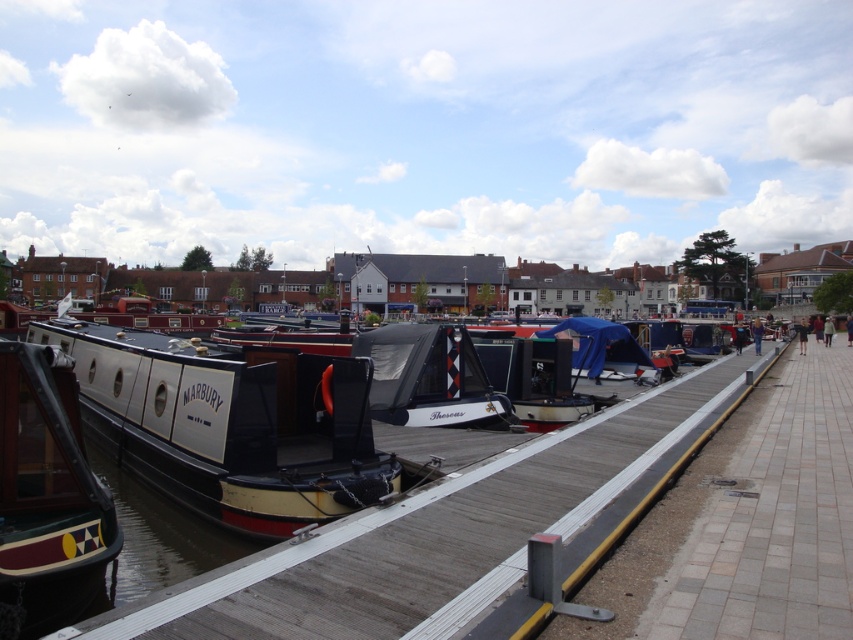
Question: Based on their relative distances, which object is nearer to the black polished wood boat at left?

Choices:
 (A) wooden dock at center
 (B) black canvas boat at center
 (C) maroon glossy boat at left

Answer: (C)

Question: In this image, where is black polished wood boat at left located relative to black canvas boat at center?

Choices:
 (A) above
 (B) below

Answer: (B)

Question: Does black polished wood boat at left lie behind black canvas boat at center?

Choices:
 (A) yes
 (B) no

Answer: (B)

Question: Estimate the real-world distances between objects in this image. Which object is closer to the black polished wood boat at left?

Choices:
 (A) maroon glossy boat at left
 (B) black canvas boat at center
 (C) wooden dock at center

Answer: (A)

Question: Can you confirm if wooden dock at center is thinner than maroon glossy boat at left?

Choices:
 (A) no
 (B) yes

Answer: (A)

Question: Among these points, which one is farthest from the camera?

Choices:
 (A) click(x=291, y=490)
 (B) click(x=115, y=540)
 (C) click(x=374, y=392)
 (D) click(x=399, y=512)

Answer: (C)